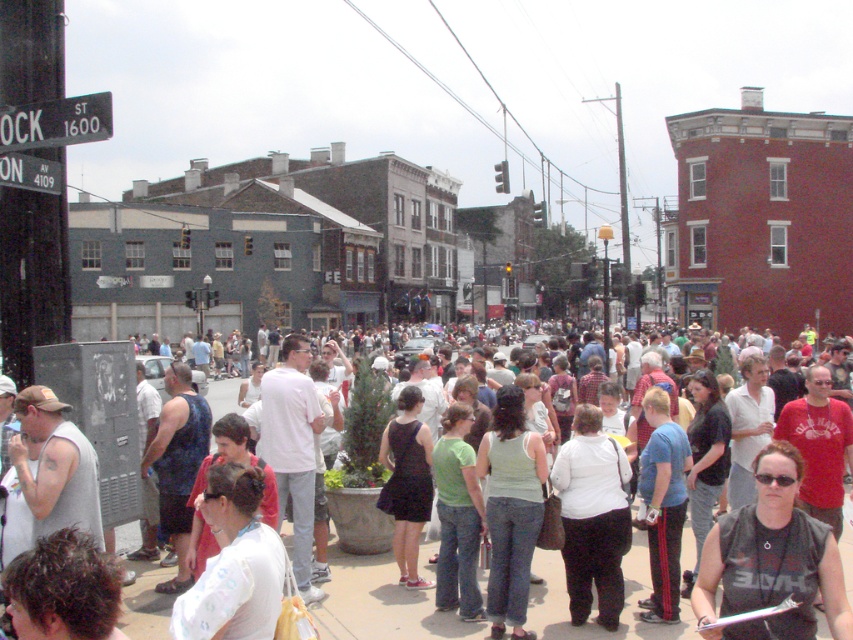
Which is more to the right, white matte shirt at center or black metal sign at upper left?

From the viewer's perspective, white matte shirt at center appears more on the right side.

Can you confirm if white matte shirt at center is thinner than black metal sign at upper left?

Incorrect, white matte shirt at center's width is not less than black metal sign at upper left's.

At what (x,y) coordinates should I click in order to perform the action: click on white matte shirt at center. Please return your answer as a coordinate pair (x, y). The width and height of the screenshot is (853, 640). Looking at the image, I should click on (592, 516).

Where is `white matte shirt at center`? The width and height of the screenshot is (853, 640). white matte shirt at center is located at coordinates (592, 516).

You are a GUI agent. You are given a task and a screenshot of the screen. Output one action in this format:
    pyautogui.click(x=<x>, y=<y>)
    Task: Click on the white fabric shirt at lower left
    This screenshot has width=853, height=640.
    Given the screenshot: What is the action you would take?
    pyautogui.click(x=233, y=563)

Consider the image. Who is more distant from viewer, (212, 483) or (498, 506)?

The point (498, 506) is behind.

This screenshot has width=853, height=640. Find the location of `white fabric shirt at lower left`. white fabric shirt at lower left is located at coordinates (233, 563).

Does black fabric tank top at center appear on the left side of black matte dress at center?

In fact, black fabric tank top at center is to the right of black matte dress at center.

Between black fabric tank top at center and black matte dress at center, which one is positioned lower?

Positioned lower is black matte dress at center.

Where is `black fabric tank top at center`? The width and height of the screenshot is (853, 640). black fabric tank top at center is located at coordinates (770, 561).